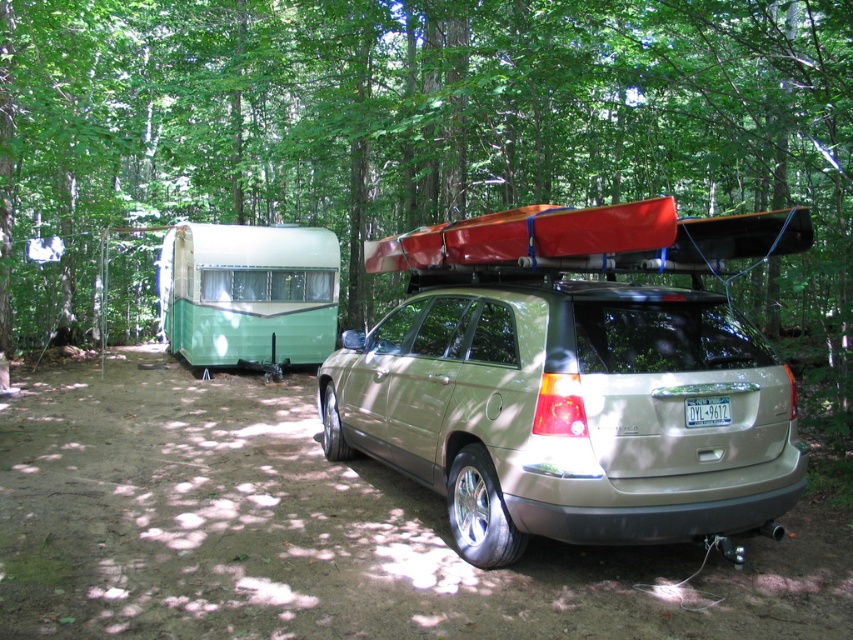
Question: Which point is closer to the camera?

Choices:
 (A) (467, 344)
 (B) (621, 186)

Answer: (A)

Question: Is green leafy tree at upper center closer to the viewer compared to satin gold suv at center?

Choices:
 (A) no
 (B) yes

Answer: (A)

Question: Does green leafy tree at upper center come in front of satin gold suv at center?

Choices:
 (A) no
 (B) yes

Answer: (A)

Question: Is the position of green leafy tree at upper center less distant than that of satin gold suv at center?

Choices:
 (A) yes
 (B) no

Answer: (B)

Question: Which point appears closest to the camera in this image?

Choices:
 (A) (637, 54)
 (B) (547, 356)

Answer: (B)

Question: Among these objects, which one is farthest from the camera?

Choices:
 (A) satin gold suv at center
 (B) green leafy tree at upper center

Answer: (B)